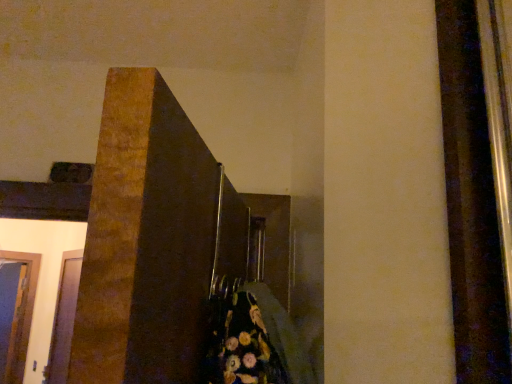
Question: Is transparent glass door at lower left, which ranks as the 2th glass door in back-to-front order, with transparent glass door at lower left, acting as the first glass door starting from the left?

Choices:
 (A) yes
 (B) no

Answer: (B)

Question: Does transparent glass door at lower left, which is the first glass door in front-to-back order, come in front of transparent glass door at lower left, which is the second glass door from right to left?

Choices:
 (A) yes
 (B) no

Answer: (A)

Question: Is transparent glass door at lower left, which is the first glass door in front-to-back order, to the left of transparent glass door at lower left, acting as the first glass door starting from the left, from the viewer's perspective?

Choices:
 (A) no
 (B) yes

Answer: (A)

Question: Is transparent glass door at lower left, which ranks as the 2th glass door in back-to-front order, bigger than transparent glass door at lower left, the first glass door when ordered from back to front?

Choices:
 (A) yes
 (B) no

Answer: (A)

Question: Does transparent glass door at lower left, which is the first glass door from right to left, have a lesser height compared to transparent glass door at lower left, acting as the first glass door starting from the left?

Choices:
 (A) no
 (B) yes

Answer: (B)

Question: From a real-world perspective, is transparent glass door at lower left, which ranks as the 2th glass door in back-to-front order, beneath transparent glass door at lower left, acting as the first glass door starting from the left?

Choices:
 (A) yes
 (B) no

Answer: (A)

Question: Considering the relative sizes of transparent glass door at lower left, acting as the first glass door starting from the left, and transparent glass door at lower left, positioned as the second glass door in left-to-right order, in the image provided, is transparent glass door at lower left, acting as the first glass door starting from the left, taller than transparent glass door at lower left, positioned as the second glass door in left-to-right order,?

Choices:
 (A) yes
 (B) no

Answer: (A)

Question: Does transparent glass door at lower left, which is the second glass door from right to left, contain transparent glass door at lower left, which is the first glass door from right to left?

Choices:
 (A) no
 (B) yes

Answer: (A)

Question: From a real-world perspective, does transparent glass door at lower left, which is the second glass door from right to left, sit lower than transparent glass door at lower left, positioned as the second glass door in left-to-right order?

Choices:
 (A) no
 (B) yes

Answer: (A)

Question: From the image's perspective, does transparent glass door at lower left, acting as the first glass door starting from the left, appear lower than transparent glass door at lower left, positioned as the second glass door in left-to-right order?

Choices:
 (A) yes
 (B) no

Answer: (A)

Question: Is transparent glass door at lower left, which is the second glass door from right to left, aimed at transparent glass door at lower left, which ranks as the 2th glass door in back-to-front order?

Choices:
 (A) yes
 (B) no

Answer: (B)

Question: Is transparent glass door at lower left, placed as the 2th glass door when sorted from front to back, thinner than transparent glass door at lower left, positioned as the second glass door in left-to-right order?

Choices:
 (A) no
 (B) yes

Answer: (B)

Question: Based on their positions, is transparent glass door at lower left, positioned as the second glass door in left-to-right order, located to the left or right of transparent glass door at lower left, acting as the first glass door starting from the left?

Choices:
 (A) left
 (B) right

Answer: (B)